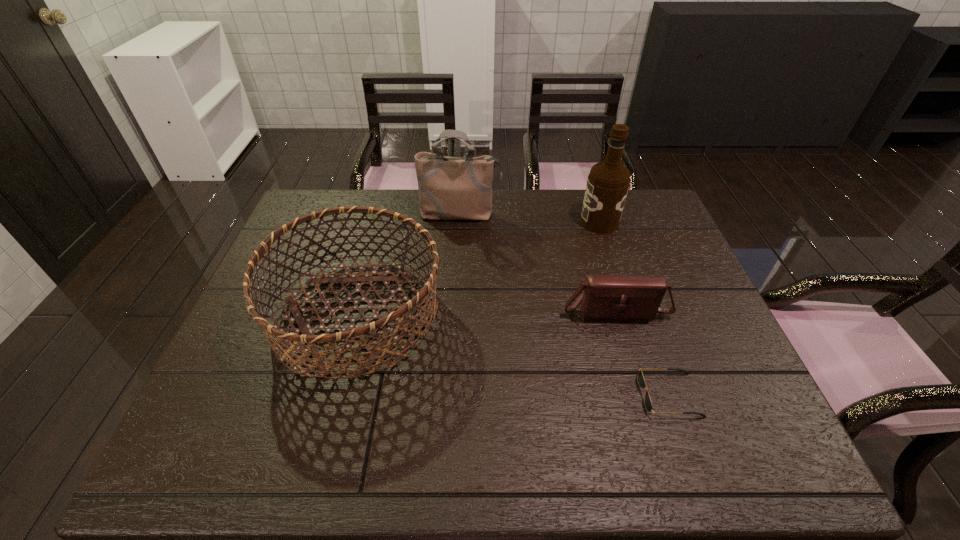
Where is `shoulder bag positioned at the right edge`? This screenshot has width=960, height=540. shoulder bag positioned at the right edge is located at coordinates (638, 297).

The height and width of the screenshot is (540, 960). Identify the location of sunglasses present at the right edge. (641, 381).

Where is `object that is at the far right corner`? object that is at the far right corner is located at coordinates (608, 182).

At what (x,y) coordinates should I click in order to perform the action: click on blank space at the far edge. Please return your answer as a coordinate pair (x, y). Looking at the image, I should click on (529, 219).

Locate an element on the screen. free space at the near edge of the desktop is located at coordinates (626, 433).

Locate an element on the screen. The width and height of the screenshot is (960, 540). vacant space at the left edge of the desktop is located at coordinates (225, 406).

In the image, there is a desktop. Where is `free space at the right edge`? The image size is (960, 540). free space at the right edge is located at coordinates (675, 240).

Where is `free space at the far left corner of the desktop`? Image resolution: width=960 pixels, height=540 pixels. free space at the far left corner of the desktop is located at coordinates (300, 209).

The image size is (960, 540). What are the coordinates of `vacant space that is in between the sunglasses and the taller shoulder bag` in the screenshot? It's located at (564, 305).

I want to click on free spot between the second shortest object and the alcohol, so click(607, 266).